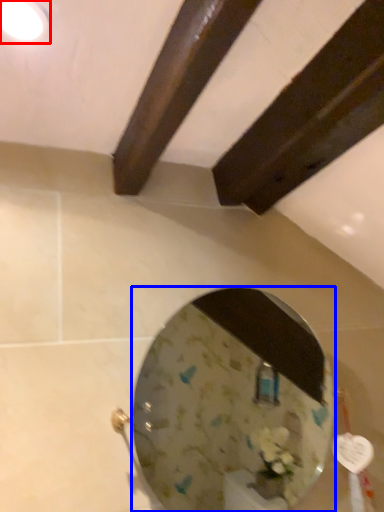
Question: Which point is further to the camera, light fixture (highlighted by a red box) or mirror (highlighted by a blue box)?

Choices:
 (A) light fixture
 (B) mirror

Answer: (B)